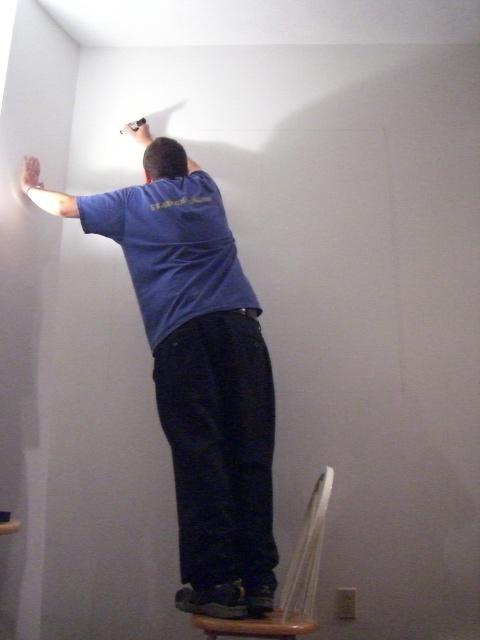
Question: Which of the following is the farthest from the observer?

Choices:
 (A) 310,624
 (B) 228,404

Answer: (B)

Question: Which of the following is the closest to the observer?

Choices:
 (A) (289, 625)
 (B) (268, 380)

Answer: (A)

Question: Can you confirm if blue t-shirt at upper center is thinner than wooden stool at lower center?

Choices:
 (A) yes
 (B) no

Answer: (B)

Question: Does blue t-shirt at upper center appear on the left side of wooden stool at lower center?

Choices:
 (A) no
 (B) yes

Answer: (B)

Question: Which of the following is the closest to the observer?

Choices:
 (A) wooden stool at lower center
 (B) blue t-shirt at upper center

Answer: (A)

Question: In this image, where is blue t-shirt at upper center located relative to wooden stool at lower center?

Choices:
 (A) left
 (B) right

Answer: (A)